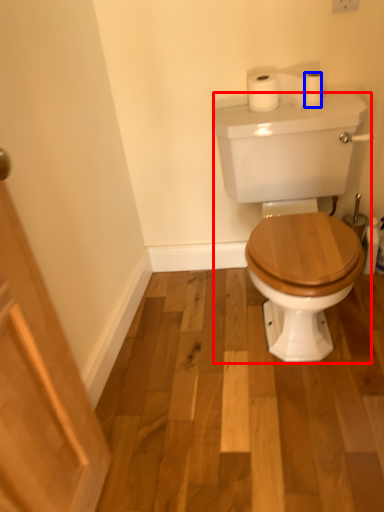
Question: Which point is closer to the camera, porcelain (highlighted by a red box) or toilet paper (highlighted by a blue box)?

Choices:
 (A) porcelain
 (B) toilet paper

Answer: (A)